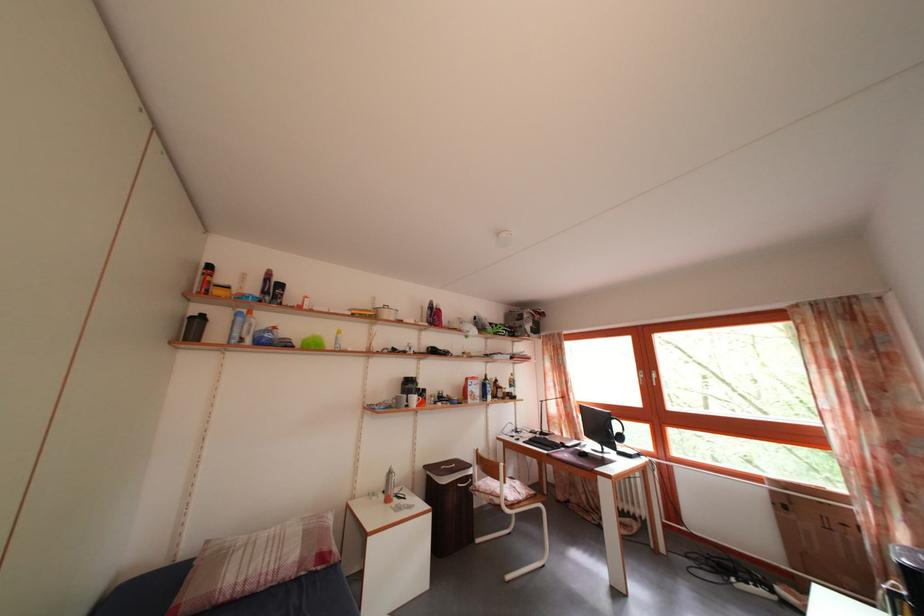
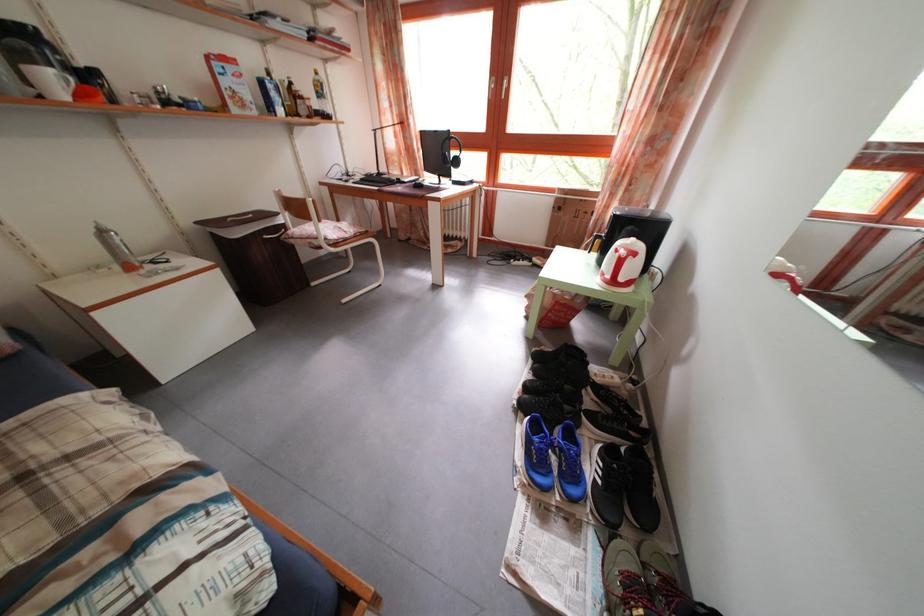
The point at (397, 480) is marked in the first image. Where is the corresponding point in the second image?

(108, 238)